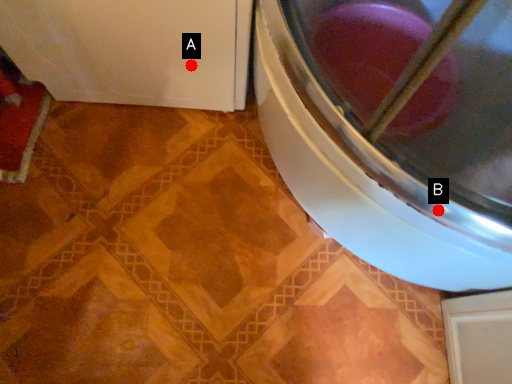
Question: Two points are circled on the image, labeled by A and B beside each circle. Among these points, which one is nearest to the camera?

Choices:
 (A) A is closer
 (B) B is closer

Answer: (B)